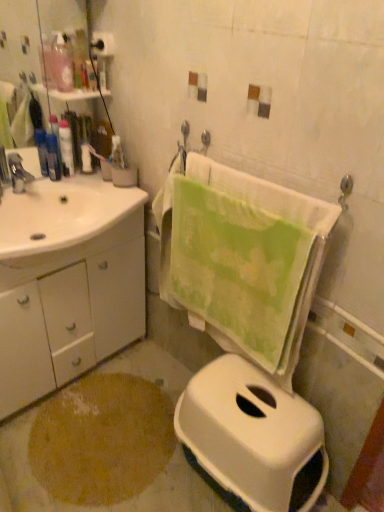
Question: From a real-world perspective, is brown textured rug at lower left located higher than matte black lotion at left, placed as the 3th toiletry when sorted from top to bottom?

Choices:
 (A) yes
 (B) no

Answer: (B)

Question: Could you tell me if brown textured rug at lower left is facing matte black lotion at left, placed as the 3th toiletry when sorted from top to bottom?

Choices:
 (A) yes
 (B) no

Answer: (B)

Question: Can you confirm if brown textured rug at lower left is positioned to the right of matte black lotion at left, which is counted as the 3th toiletry, starting from the right?

Choices:
 (A) no
 (B) yes

Answer: (B)

Question: Is brown textured rug at lower left positioned with its back to matte black lotion at left, placed as the 3th toiletry when sorted from top to bottom?

Choices:
 (A) no
 (B) yes

Answer: (A)

Question: From a real-world perspective, does brown textured rug at lower left sit lower than matte black lotion at left, which is the 1th toiletry in left-to-right order?

Choices:
 (A) no
 (B) yes

Answer: (B)

Question: From the image's perspective, is white glossy cabinet at left above or below matte black lotion at left, the 2th toiletry positioned from the top?

Choices:
 (A) above
 (B) below

Answer: (B)

Question: From a real-world perspective, is white glossy cabinet at left positioned above or below matte black lotion at left, which appears as the second toiletry when viewed from the left?

Choices:
 (A) above
 (B) below

Answer: (B)

Question: Would you say white glossy cabinet at left is to the left or to the right of matte black lotion at left, which appears as the second toiletry when viewed from the left, in the picture?

Choices:
 (A) right
 (B) left

Answer: (B)

Question: Is white glossy cabinet at left inside or outside of matte black lotion at left, arranged as the 2th toiletry when viewed from the right?

Choices:
 (A) inside
 (B) outside

Answer: (B)

Question: From their relative heights in the image, would you say green cotton towel at center is taller or shorter than brown textured rug at lower left?

Choices:
 (A) tall
 (B) short

Answer: (A)

Question: Relative to brown textured rug at lower left, is green cotton towel at center in front or behind?

Choices:
 (A) front
 (B) behind

Answer: (A)

Question: In terms of size, does green cotton towel at center appear bigger or smaller than brown textured rug at lower left?

Choices:
 (A) small
 (B) big

Answer: (B)

Question: From the image's perspective, is green cotton towel at center above or below brown textured rug at lower left?

Choices:
 (A) above
 (B) below

Answer: (A)

Question: In terms of height, does matte silver faucet at left look taller or shorter compared to green cotton towel at center?

Choices:
 (A) short
 (B) tall

Answer: (A)

Question: Based on their positions, is matte silver faucet at left located to the left or right of green cotton towel at center?

Choices:
 (A) left
 (B) right

Answer: (A)